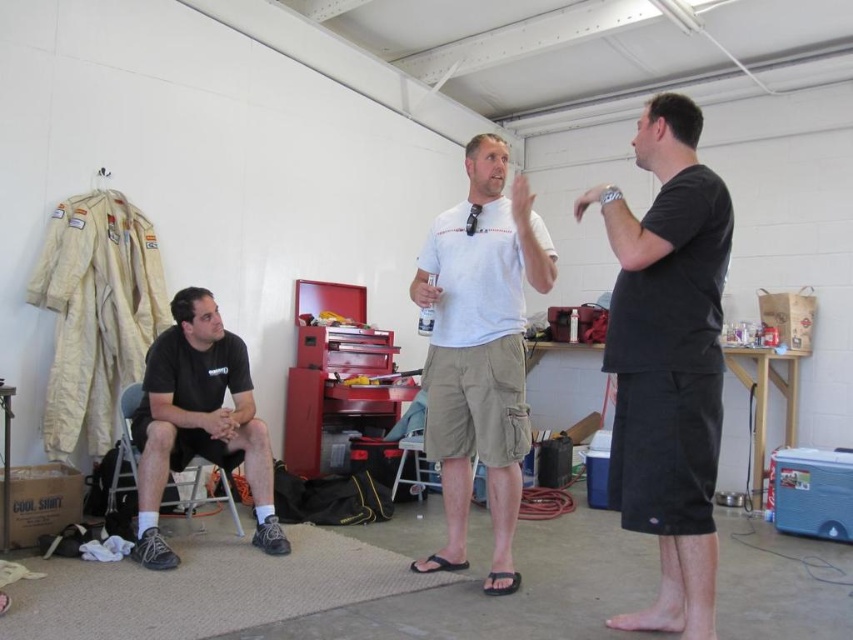
Which is more to the right, black cotton t-shirt at right or white cotton t-shirt at center?

From the viewer's perspective, black cotton t-shirt at right appears more on the right side.

Between point (668, 340) and point (432, 413), which one is positioned behind?

Positioned behind is point (432, 413).

Between point (640, 516) and point (457, 282), which one is positioned in front?

Point (640, 516)

Where is `black cotton t-shirt at right`? black cotton t-shirt at right is located at coordinates (668, 362).

Which of these two, black cotton t-shirt at right or black matte shirt at left, stands shorter?

black matte shirt at left is shorter.

Between point (697, 432) and point (180, 460), which one is positioned in front?

Point (697, 432) is in front.

The height and width of the screenshot is (640, 853). What are the coordinates of `black cotton t-shirt at right` in the screenshot? It's located at (668, 362).

From the picture: Which is below, white cotton t-shirt at center or black matte shirt at left?

black matte shirt at left is below.

Can you confirm if white cotton t-shirt at center is wider than black matte shirt at left?

Incorrect, white cotton t-shirt at center's width does not surpass black matte shirt at left's.

What do you see at coordinates (480, 349) in the screenshot? This screenshot has width=853, height=640. I see `white cotton t-shirt at center` at bounding box center [480, 349].

The width and height of the screenshot is (853, 640). Identify the location of white cotton t-shirt at center. (480, 349).